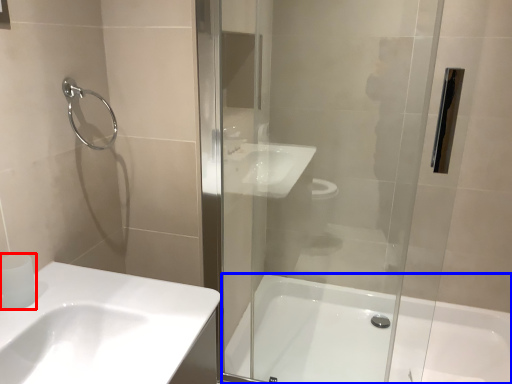
Question: Among these objects, which one is nearest to the camera, toilet paper (highlighted by a red box) or bathtub (highlighted by a blue box)?

Choices:
 (A) toilet paper
 (B) bathtub

Answer: (A)